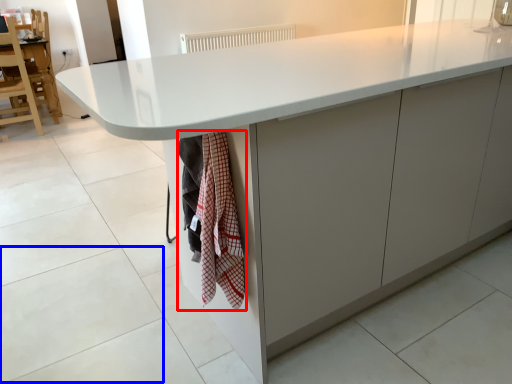
Question: Which of the following is the farthest to the observer, blanket (highlighted by a red box) or granite (highlighted by a blue box)?

Choices:
 (A) blanket
 (B) granite

Answer: (B)